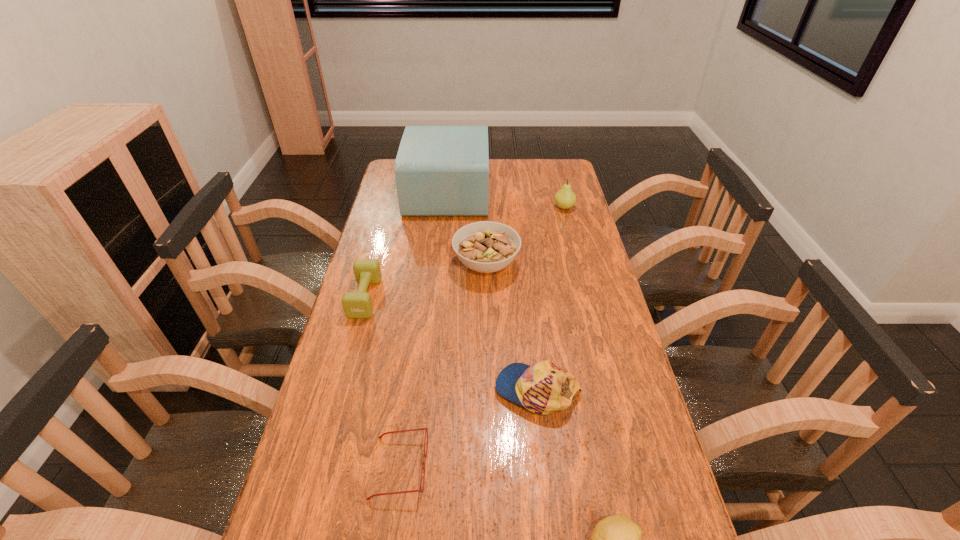
Locate an element on the screen. The image size is (960, 540). blank space located on the bill of the cap is located at coordinates pos(432,390).

Locate an element on the screen. This screenshot has height=540, width=960. free space located on the bill of the cap is located at coordinates (417, 390).

Find the location of a particular element. free space located 0.110m on the bill of the cap is located at coordinates (452, 390).

Where is `free location located 0.080m on the front of the dumbbell`? Image resolution: width=960 pixels, height=540 pixels. free location located 0.080m on the front of the dumbbell is located at coordinates (353, 341).

Where is `vacant space located on the face of the second nearest object`? The image size is (960, 540). vacant space located on the face of the second nearest object is located at coordinates (513, 467).

Where is `object present at the far edge`? The height and width of the screenshot is (540, 960). object present at the far edge is located at coordinates (440, 170).

Identify the location of radio receiver that is at the left edge. (440, 170).

At what (x,y) coordinates should I click in order to perform the action: click on dumbbell that is at the left edge. Please return your answer as a coordinate pair (x, y). This screenshot has width=960, height=540. Looking at the image, I should click on click(x=358, y=304).

You are a GUI agent. You are given a task and a screenshot of the screen. Output one action in this format:
    pyautogui.click(x=<x>, y=<y>)
    Task: Click on the pear that is at the right edge
    Image resolution: width=960 pixels, height=540 pixels.
    Given the screenshot: What is the action you would take?
    pyautogui.click(x=565, y=198)

Where is `cap positioned at the right edge`? This screenshot has width=960, height=540. cap positioned at the right edge is located at coordinates (543, 388).